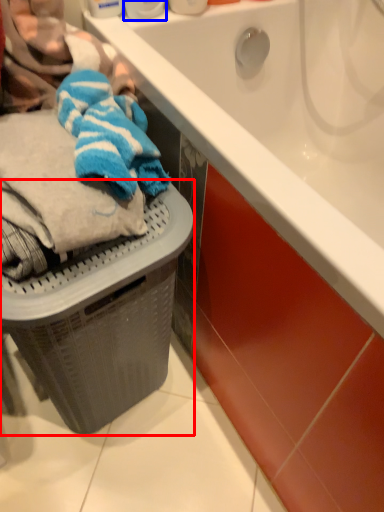
Question: Which point is further to the camera, basket container (highlighted by a red box) or toiletry (highlighted by a blue box)?

Choices:
 (A) basket container
 (B) toiletry

Answer: (B)